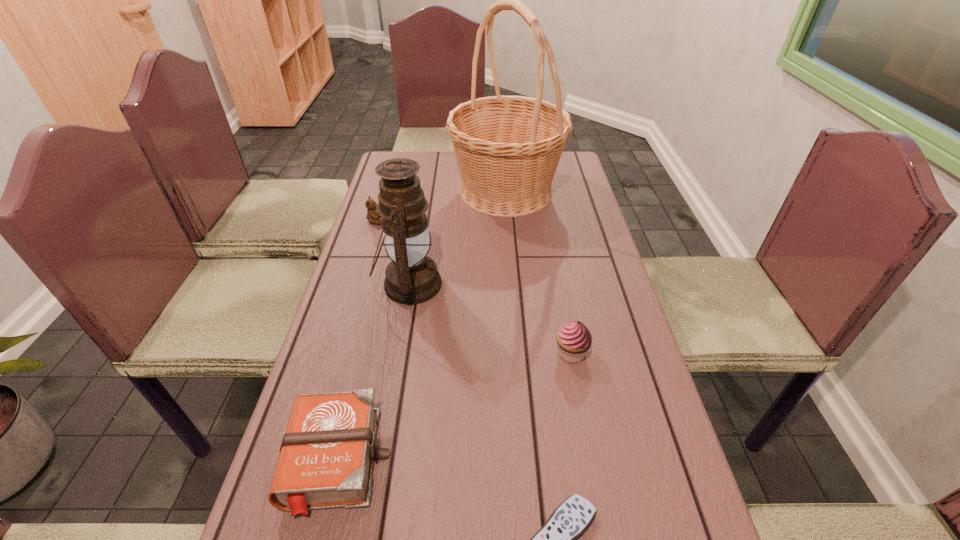
Locate an element on the screen. The height and width of the screenshot is (540, 960). free space that satisfies the following two spatial constraints: 1. on the front-facing side of the third farthest object; 2. on the right side of the teddy bear is located at coordinates (356, 285).

Where is `free spot that satisfies the following two spatial constraints: 1. on the front-facing side of the teddy bear; 2. on the left side of the third tallest object`? This screenshot has height=540, width=960. free spot that satisfies the following two spatial constraints: 1. on the front-facing side of the teddy bear; 2. on the left side of the third tallest object is located at coordinates (335, 353).

Find the location of a particular element. The width and height of the screenshot is (960, 540). vacant space that satisfies the following two spatial constraints: 1. on the back side of the Bible; 2. on the front-facing side of the teddy bear is located at coordinates (396, 220).